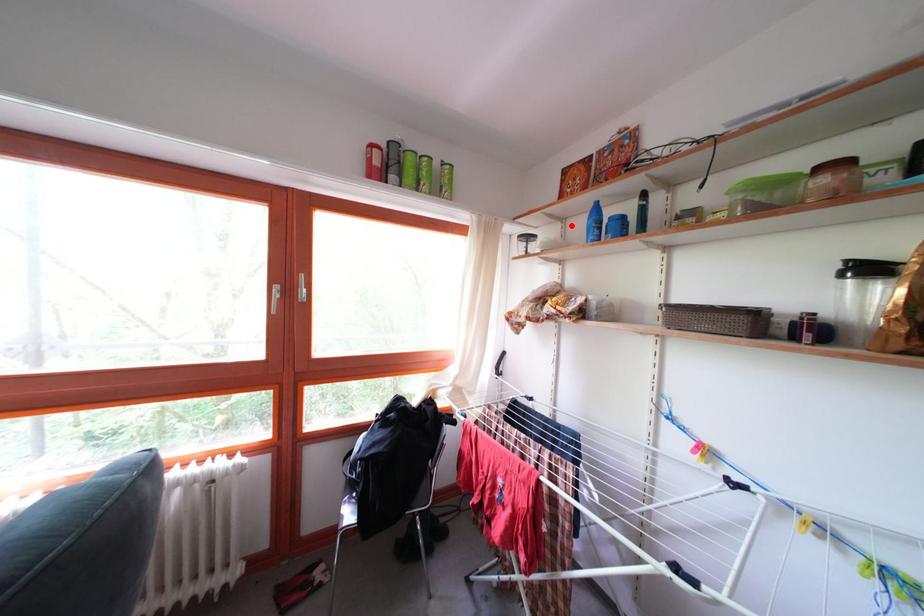
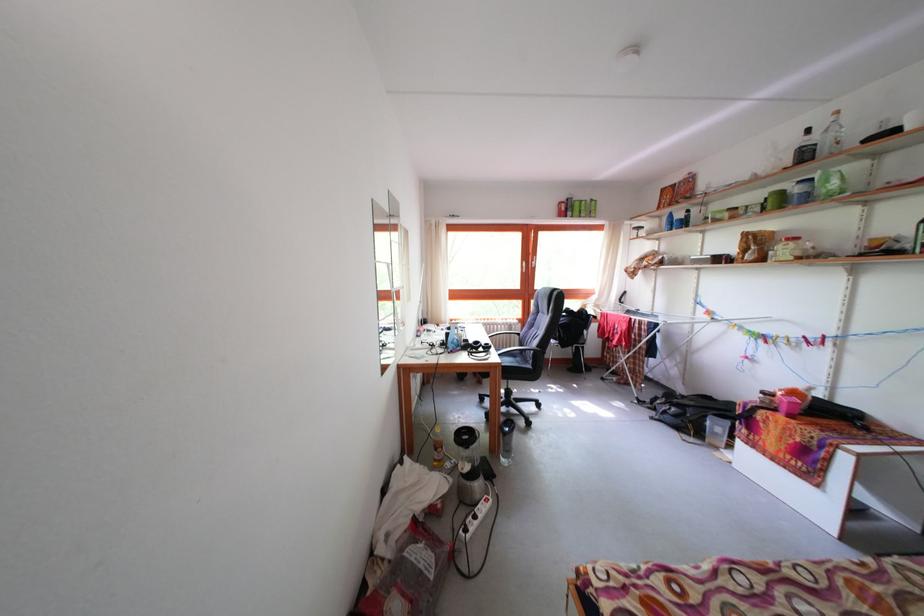
Find the pixel in the second image that matches the highlighted location in the first image.

(667, 224)